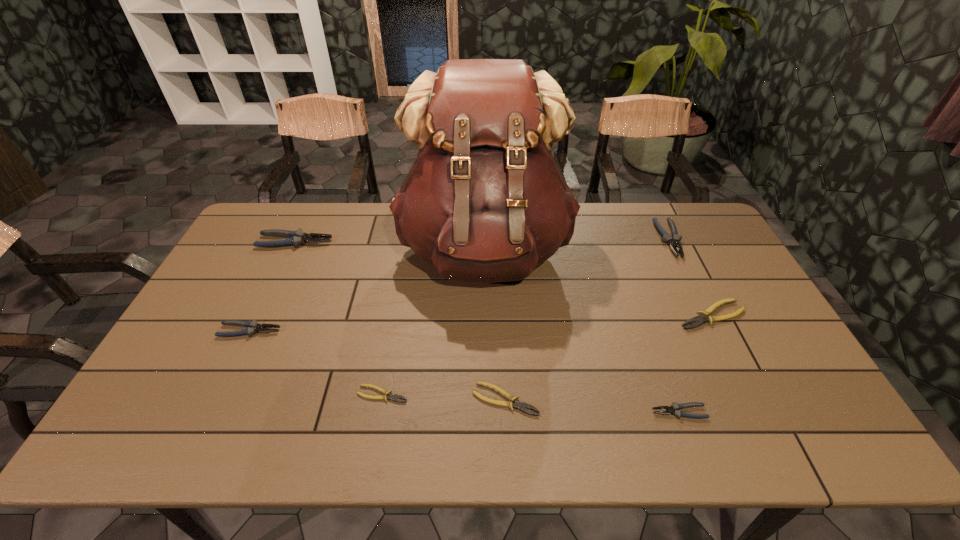
Image resolution: width=960 pixels, height=540 pixels. In the image, there is a desktop. Identify the location of vacant space at the right edge. pos(708,254).

The width and height of the screenshot is (960, 540). Identify the location of free space between the second yellow pliers from right to left and the shortest pliers. (444, 397).

Locate an element on the screen. The height and width of the screenshot is (540, 960). free space between the rightmost gray pliers and the tallest object is located at coordinates (577, 245).

The image size is (960, 540). What are the coordinates of `vacant area that lies between the rightmost yellow pliers and the fifth shortest pliers` in the screenshot? It's located at (481, 323).

The width and height of the screenshot is (960, 540). I want to click on free spot between the shortest object and the second yellow pliers from right to left, so click(444, 397).

The width and height of the screenshot is (960, 540). In order to click on free space between the fifth shortest object and the second yellow pliers from right to left in this screenshot , I will do `click(377, 365)`.

The width and height of the screenshot is (960, 540). I want to click on vacant area that lies between the nearest gray pliers and the satchel, so click(x=582, y=331).

Where is `free spot between the rightmost yellow pliers and the third tallest pliers`? The width and height of the screenshot is (960, 540). free spot between the rightmost yellow pliers and the third tallest pliers is located at coordinates (481, 323).

Identify which object is the nearest to the seventh shortest object. Please provide its 2D coordinates. Your answer should be formatted as a tuple, i.e. [(x, y)], where the tuple contains the x and y coordinates of a point satisfying the conditions above.

[(484, 202)]

The image size is (960, 540). I want to click on object that stands as the seventh closest to the sixth shortest pliers, so click(253, 327).